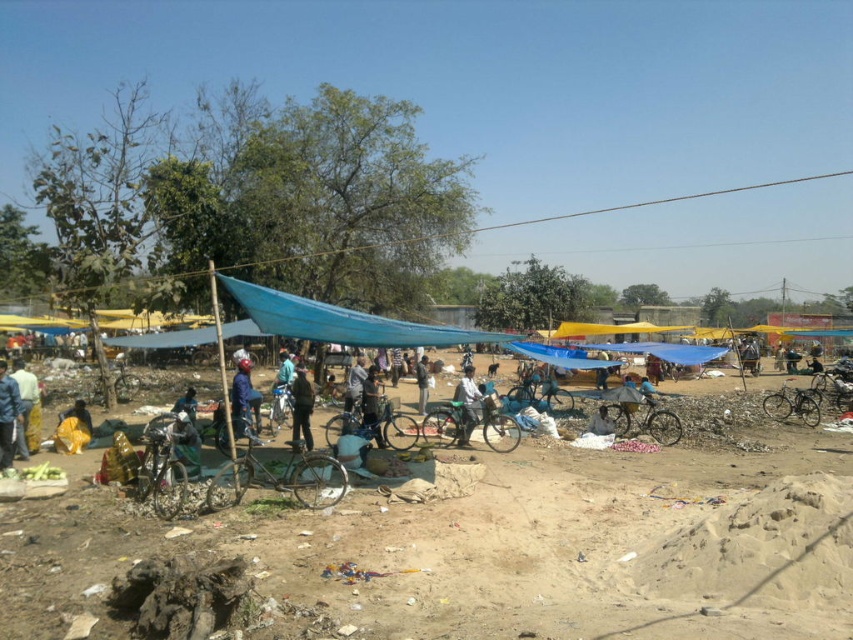
You are a customer at the market and want to buy a jacket. You see the blue fabric at center and the dark brown leather jacket at center. Which item is positioned more to the left?

The blue fabric at center is positioned to the left of the dark brown leather jacket at center.

You are standing at the entrance of the outdoor market and want to reach the brown sandy dirt field at center. Which direction should you walk to get there?

The brown sandy dirt field at center is located at point 0.863 on the x and 0.555 on the y coordinates, so you should walk towards the center of the market to reach it.